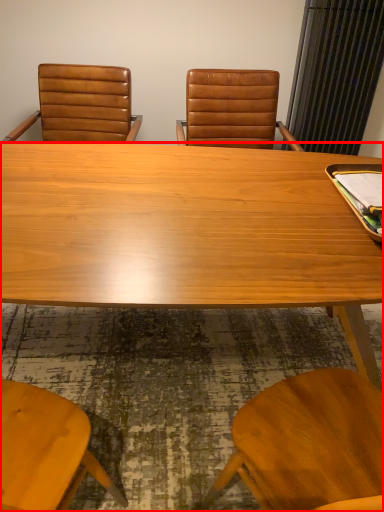
Question: In this image, where is desk (annotated by the red box) located relative to chair?

Choices:
 (A) left
 (B) right

Answer: (B)